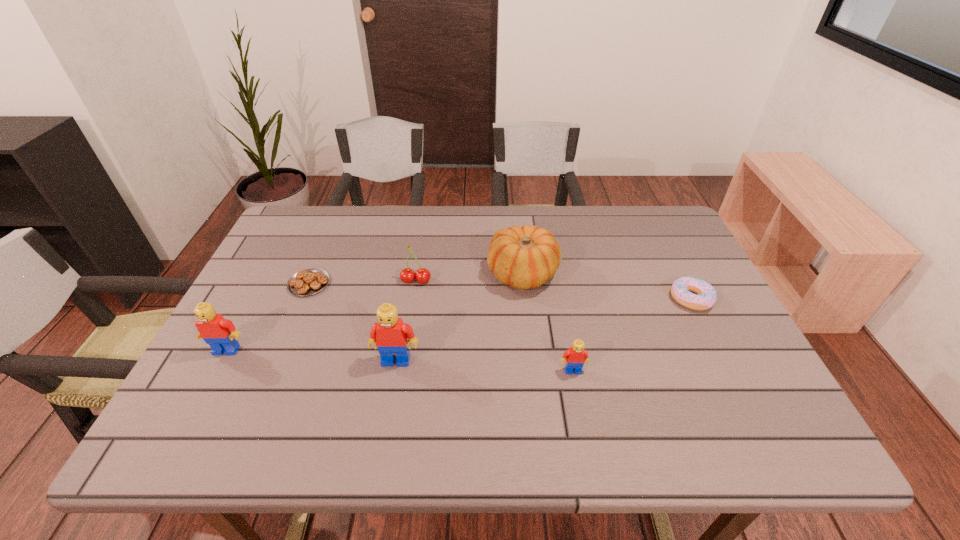
Image resolution: width=960 pixels, height=540 pixels. In the image, there is a desktop. What are the coordinates of `vacant space at the near edge` in the screenshot? It's located at (349, 379).

Locate an element on the screen. This screenshot has height=540, width=960. vacant space at the left edge of the desktop is located at coordinates (260, 343).

This screenshot has height=540, width=960. I want to click on vacant space at the right edge of the desktop, so click(x=688, y=357).

You are a GUI agent. You are given a task and a screenshot of the screen. Output one action in this format:
    pyautogui.click(x=<x>, y=<y>)
    Task: Click on the free space at the far left corner of the desktop
    This screenshot has height=540, width=960.
    Given the screenshot: What is the action you would take?
    pyautogui.click(x=309, y=233)

Where is `vacant space at the near right corner of the desktop`? The height and width of the screenshot is (540, 960). vacant space at the near right corner of the desktop is located at coordinates (761, 385).

Where is `empty space between the second Lego from left to right and the gourd`? empty space between the second Lego from left to right and the gourd is located at coordinates (460, 317).

Where is `free space between the shortest Lego and the pastry`? free space between the shortest Lego and the pastry is located at coordinates (441, 327).

Identify the location of empty location between the rightmost Lego and the sixth object from right to left. This screenshot has width=960, height=540. (441, 327).

What are the coordinates of `free spot between the second tallest Lego and the cherry` in the screenshot? It's located at (322, 315).

Image resolution: width=960 pixels, height=540 pixels. I want to click on unoccupied area between the rightmost object and the cherry, so click(x=554, y=290).